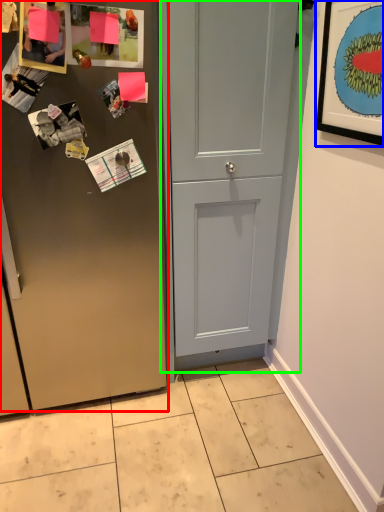
Question: Considering the real-world distances, which object is closest to door (highlighted by a red box)? picture frame (highlighted by a blue box) or door (highlighted by a green box).

Choices:
 (A) picture frame
 (B) door

Answer: (B)